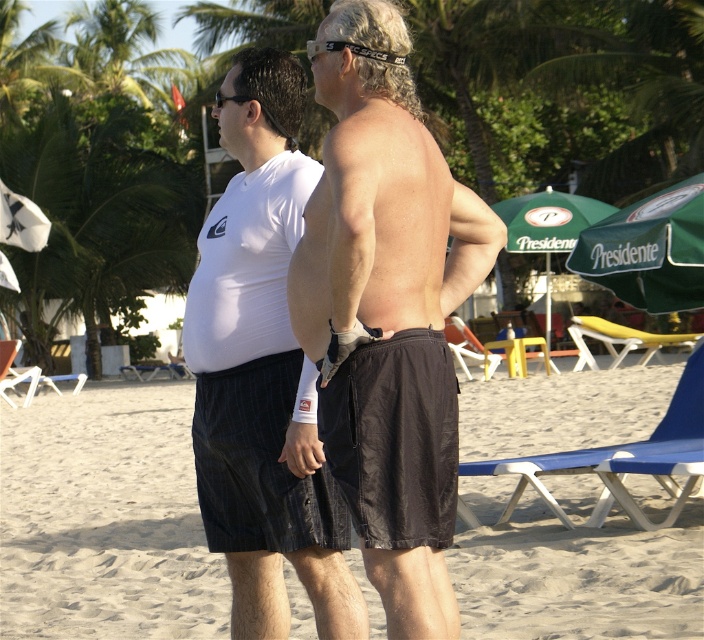
Who is higher up, black fabric shorts at center or white matte t-shirt at center?

white matte t-shirt at center is higher up.

Is point (130, 387) farther from camera compared to point (406, 488)?

Yes, point (130, 387) is behind point (406, 488).

Find the location of a particular element. This screenshot has height=640, width=704. black fabric shorts at center is located at coordinates (106, 518).